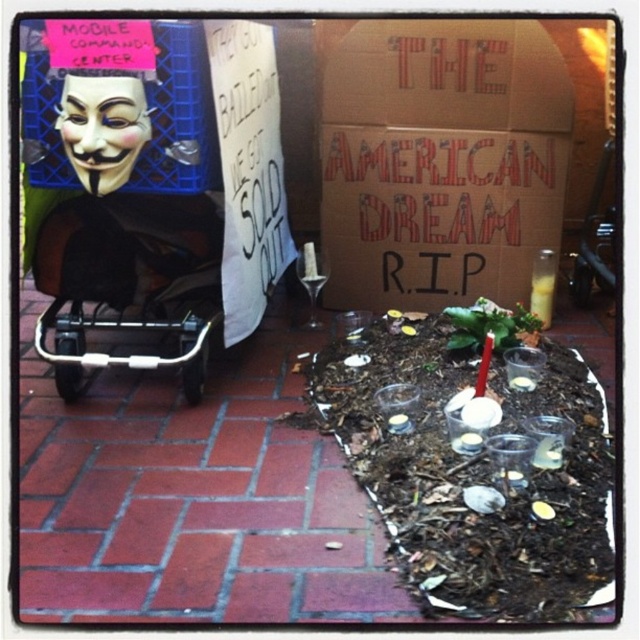
Question: Does brown mulch at center appear over cardboard at center?

Choices:
 (A) no
 (B) yes

Answer: (A)

Question: Which of these objects is positioned closest to the metallic silver baby carriage at left?

Choices:
 (A) cardboard at center
 (B) brown mulch at center

Answer: (B)

Question: Does brown mulch at center have a lesser width compared to metallic silver baby carriage at left?

Choices:
 (A) yes
 (B) no

Answer: (B)

Question: Is cardboard at center smaller than metallic silver baby carriage at left?

Choices:
 (A) no
 (B) yes

Answer: (A)

Question: Considering the real-world distances, which object is closest to the cardboard at center?

Choices:
 (A) metallic silver baby carriage at left
 (B) brown mulch at center

Answer: (A)

Question: Which point appears closest to the camera in this image?

Choices:
 (A) (355, 266)
 (B) (195, 244)

Answer: (B)